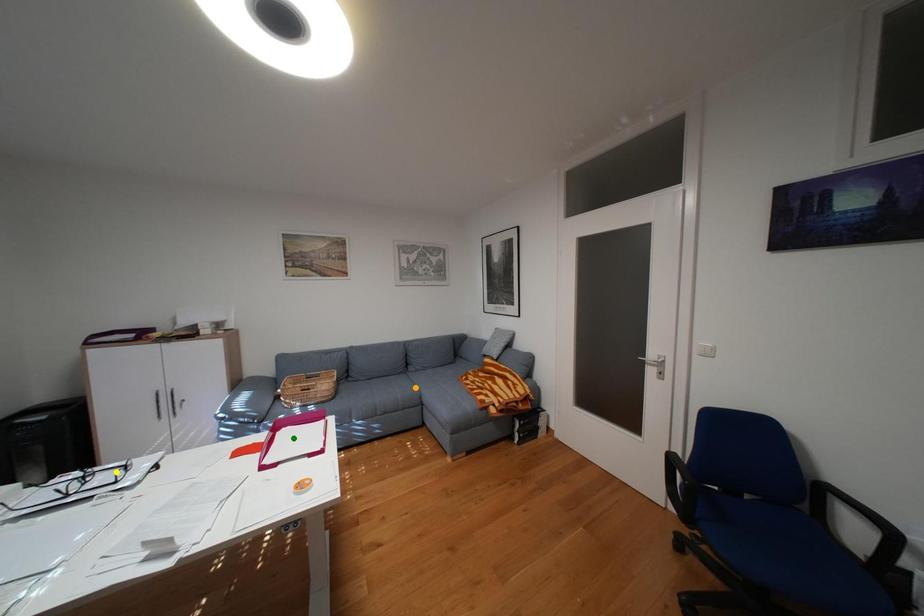
Order these from nearest to farthest:
yellow point, orange point, green point

yellow point
green point
orange point